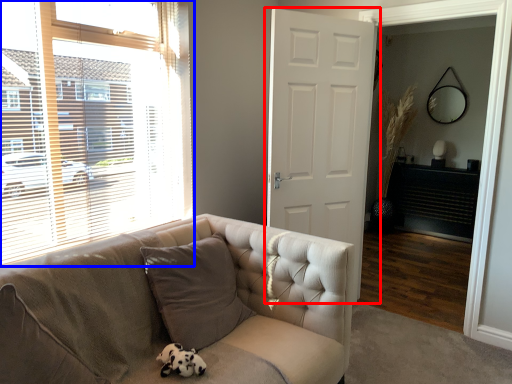
Question: Which object is further to the camera taking this photo, door (highlighted by a red box) or window (highlighted by a blue box)?

Choices:
 (A) door
 (B) window

Answer: (A)